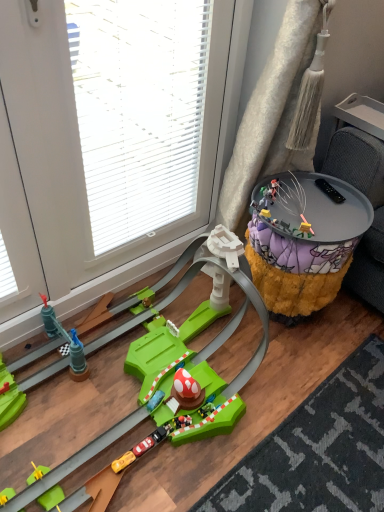
Question: Does green plastic race track at lower left, the 1th toy positioned from the front, appear on the right side of transparent plastic glass door at upper left?

Choices:
 (A) yes
 (B) no

Answer: (A)

Question: Are green plastic race track at lower left, the 1th toy positioned from the front, and transparent plastic glass door at upper left making contact?

Choices:
 (A) yes
 (B) no

Answer: (B)

Question: Is green plastic race track at lower left, the first toy in the left-to-right sequence, facing away from transparent plastic glass door at upper left?

Choices:
 (A) no
 (B) yes

Answer: (B)

Question: Can transparent plastic glass door at upper left be found inside green plastic race track at lower left, the second toy in the right-to-left sequence?

Choices:
 (A) no
 (B) yes

Answer: (A)

Question: Is green plastic race track at lower left, the first toy in the left-to-right sequence, outside of transparent plastic glass door at upper left?

Choices:
 (A) yes
 (B) no

Answer: (A)

Question: Is metallic gold figure at center-right, the second toy positioned from the front, bigger or smaller than transparent plastic glass door at upper left?

Choices:
 (A) small
 (B) big

Answer: (A)

Question: Would you say metallic gold figure at center-right, the 2th toy when ordered from left to right, is inside or outside transparent plastic glass door at upper left?

Choices:
 (A) inside
 (B) outside

Answer: (B)

Question: Is metallic gold figure at center-right, the 2th toy when ordered from left to right, taller or shorter than transparent plastic glass door at upper left?

Choices:
 (A) tall
 (B) short

Answer: (B)

Question: Is metallic gold figure at center-right, the second toy positioned from the front, in front of or behind transparent plastic glass door at upper left in the image?

Choices:
 (A) behind
 (B) front

Answer: (A)

Question: From the image's perspective, is transparent plastic glass door at upper left above or below metallic gold figure at center-right, the 2th toy when ordered from left to right?

Choices:
 (A) below
 (B) above

Answer: (B)

Question: In terms of size, does transparent plastic glass door at upper left appear bigger or smaller than metallic gold figure at center-right, acting as the 1th toy starting from the top?

Choices:
 (A) big
 (B) small

Answer: (A)

Question: Is transparent plastic glass door at upper left inside or outside of metallic gold figure at center-right, arranged as the 1th toy when viewed from the right?

Choices:
 (A) inside
 (B) outside

Answer: (B)

Question: Is point (109, 40) positioned closer to the camera than point (311, 225)?

Choices:
 (A) closer
 (B) farther

Answer: (A)

Question: From the image's perspective, is shaggy yellow ottoman at right above or below metallic gold figure at center-right, the first toy when ordered from back to front?

Choices:
 (A) above
 (B) below

Answer: (B)

Question: Visually, is shaggy yellow ottoman at right positioned to the left or to the right of metallic gold figure at center-right, the second toy positioned from the front?

Choices:
 (A) right
 (B) left

Answer: (A)